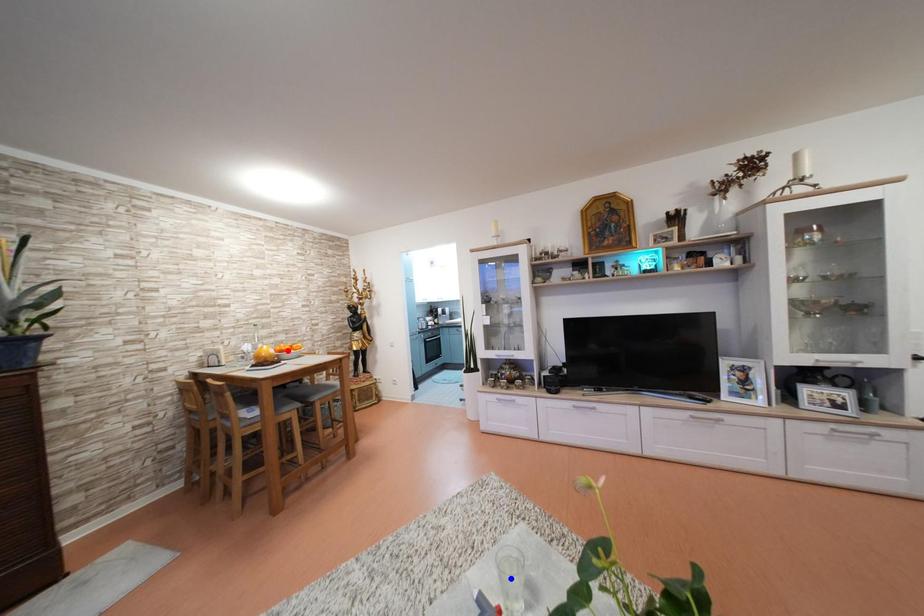
Question: In the image, two points are highlighted. Which point is nearer to the camera? Reply with the corresponding letter.

Choices:
 (A) blue point
 (B) red point

Answer: (A)